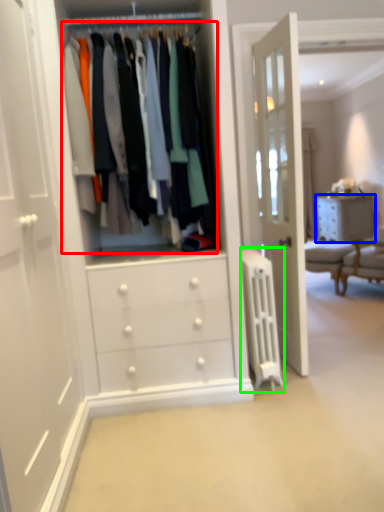
Question: Which object is positioned closest to closet (highlighted by a red box)? Select from chest of drawers (highlighted by a blue box) and wide (highlighted by a green box).

Choices:
 (A) chest of drawers
 (B) wide

Answer: (B)